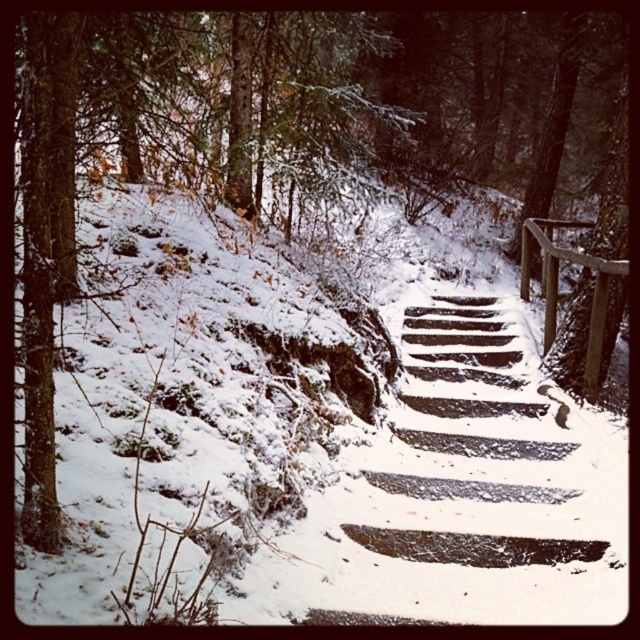
Consider the image. Is snow-covered wooden steps at center to the left of wooden at right from the viewer's perspective?

Correct, you'll find snow-covered wooden steps at center to the left of wooden at right.

Which is more to the right, snow-covered wooden steps at center or wooden at right?

wooden at right is more to the right.

Does point (445, 305) come behind point (541, 291)?

No.

This screenshot has height=640, width=640. Find the location of `snow-covered wooden steps at center`. snow-covered wooden steps at center is located at coordinates (476, 488).